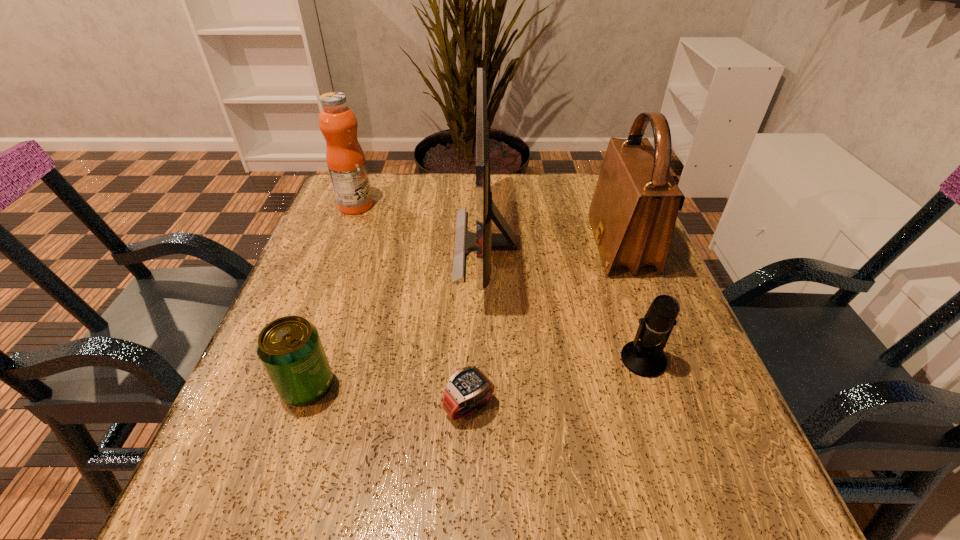
Where is `vacant region located on the front flap of the shoulder bag`? vacant region located on the front flap of the shoulder bag is located at coordinates (554, 246).

The height and width of the screenshot is (540, 960). In order to click on vacant region located 0.210m on the front flap of the shoulder bag in this screenshot , I will do `click(501, 246)`.

Locate an element on the screen. vacant region located on the back of the fruit juice is located at coordinates (365, 183).

Locate an element on the screen. This screenshot has height=540, width=960. vacant space located 0.110m on the front of the microphone is located at coordinates (671, 440).

Locate an element on the screen. vacant space located on the back of the beer can is located at coordinates (331, 318).

Where is `vacant region located on the left of the watch`? This screenshot has width=960, height=540. vacant region located on the left of the watch is located at coordinates (355, 407).

Find the location of a particular element. This screenshot has width=960, height=540. monitor present at the far edge is located at coordinates (483, 241).

You are a GUI agent. You are given a task and a screenshot of the screen. Output one action in this format:
    pyautogui.click(x=<x>, y=<y>)
    Task: Click on the shoulder bag at the far edge
    
    Given the screenshot: What is the action you would take?
    pyautogui.click(x=633, y=212)

Find the location of a particular element. This screenshot has height=540, width=960. fruit juice that is at the far edge is located at coordinates (345, 158).

The width and height of the screenshot is (960, 540). Find the location of `fruit juice located in the left edge section of the desktop`. fruit juice located in the left edge section of the desktop is located at coordinates (345, 158).